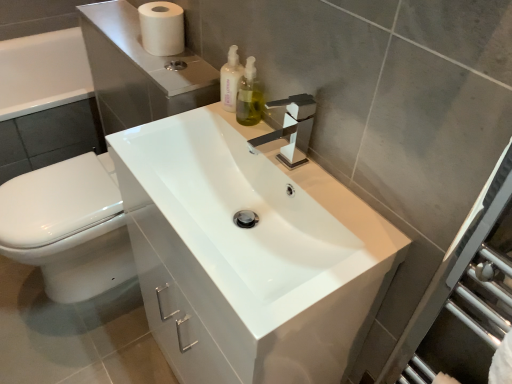
Identify the location of vacant region above white glossy toilet at lower left (from a real-world perspective). The image size is (512, 384). (58, 189).